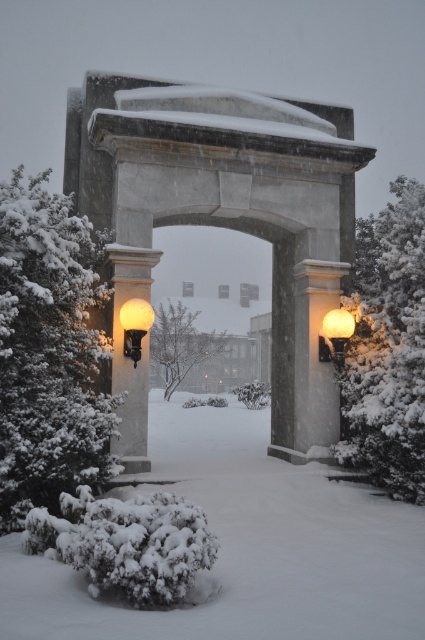
Does point (175, 486) come behind point (167, 301)?

No, it is in front of (167, 301).

The height and width of the screenshot is (640, 425). Describe the element at coordinates (244, 547) in the screenshot. I see `white fluffy snow at center` at that location.

Where is `white fluffy snow at center`? white fluffy snow at center is located at coordinates (244, 547).

From the picture: Which is below, green leafy tree at center or matte glass globe at left?

green leafy tree at center is lower down.

Between point (152, 365) and point (141, 321), which one is positioned in front?

Point (141, 321) is in front.

This screenshot has height=640, width=425. I want to click on green leafy tree at center, so click(x=180, y=342).

Is snow-covered evergreen at right below matte glass globe at left?

Actually, snow-covered evergreen at right is above matte glass globe at left.

Between snow-covered evergreen at right and matte glass globe at left, which one appears on the left side from the viewer's perspective?

matte glass globe at left

The image size is (425, 640). What do you see at coordinates (388, 348) in the screenshot?
I see `snow-covered evergreen at right` at bounding box center [388, 348].

This screenshot has width=425, height=640. What are the coordinates of `snow-covered evergreen at right` in the screenshot? It's located at (388, 348).